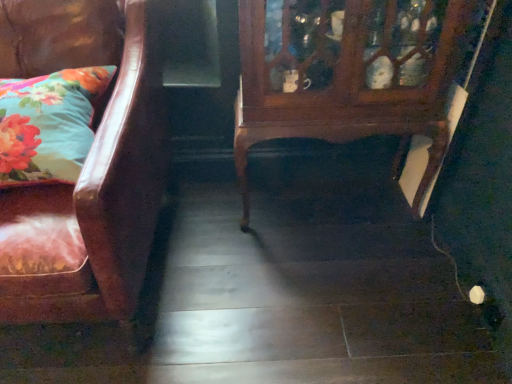
Describe the element at coordinates (93, 157) in the screenshot. This screenshot has height=384, width=512. I see `leather couch at left` at that location.

What do you see at coordinates (48, 124) in the screenshot?
I see `floral fabric pillow at left` at bounding box center [48, 124].

This screenshot has height=384, width=512. Find the location of `leather couch at left`. leather couch at left is located at coordinates (93, 157).

Considering the positions of objects wooden cabinet at center and floral fabric pillow at left in the image provided, who is more to the left, wooden cabinet at center or floral fabric pillow at left?

From the viewer's perspective, floral fabric pillow at left appears more on the left side.

Is wooden cabinet at center thinner than floral fabric pillow at left?

Yes.

Is wooden cabinet at center surrounding floral fabric pillow at left?

No, floral fabric pillow at left is not surrounded by wooden cabinet at center.

Considering the positions of objects wooden cabinet at center and floral fabric pillow at left in the image provided, who is in front, wooden cabinet at center or floral fabric pillow at left?

floral fabric pillow at left.

From a real-world perspective, is floral fabric pillow at left beneath leather couch at left?

No, from a real-world perspective, floral fabric pillow at left is not below leather couch at left.

Is floral fabric pillow at left to the left of leather couch at left from the viewer's perspective?

In fact, floral fabric pillow at left is to the right of leather couch at left.

Does point (39, 156) lie behind point (60, 2)?

No, (39, 156) is closer to viewer.

Can you confirm if floral fabric pillow at left is shorter than leather couch at left?

Indeed, floral fabric pillow at left has a lesser height compared to leather couch at left.

From the image's perspective, is floral fabric pillow at left located above or below wooden cabinet at center?

From the image's perspective, floral fabric pillow at left appears below wooden cabinet at center.

Are floral fabric pillow at left and wooden cabinet at center far apart?

That's not correct — floral fabric pillow at left is a little close to wooden cabinet at center.

Is floral fabric pillow at left aimed at wooden cabinet at center?

No, floral fabric pillow at left is not aimed at wooden cabinet at center.

Which is behind, point (81, 138) or point (295, 51)?

The point (295, 51) is more distant.

Is leather couch at left far from wooden cabinet at center?

Actually, leather couch at left and wooden cabinet at center are a little close together.

Is leather couch at left positioned with its back to wooden cabinet at center?

leather couch at left does not have its back to wooden cabinet at center.

Locate an element on the screen. The image size is (512, 384). furniture on the right of leather couch at left is located at coordinates (347, 74).

Is leather couch at left to the left of wooden cabinet at center from the viewer's perspective?

Yes.

Is leather couch at left wider than floral fabric pillow at left?

Yes, leather couch at left is wider than floral fabric pillow at left.

From a real-world perspective, is leather couch at left under floral fabric pillow at left?

Yes.

Is leather couch at left aimed at floral fabric pillow at left?

Yes, leather couch at left is oriented towards floral fabric pillow at left.

Would you consider leather couch at left to be distant from floral fabric pillow at left?

That's not correct — leather couch at left is a little close to floral fabric pillow at left.

Considering the sizes of objects wooden cabinet at center and leather couch at left in the image provided, who is wider, wooden cabinet at center or leather couch at left?

Wider between the two is leather couch at left.

From a real-world perspective, is wooden cabinet at center under leather couch at left?

Yes, from a real-world perspective, wooden cabinet at center is beneath leather couch at left.

Does wooden cabinet at center touch leather couch at left?

No, wooden cabinet at center is not with leather couch at left.

Does wooden cabinet at center turn towards leather couch at left?

No.

Where is `furniture located on the right of floral fabric pillow at left`? The image size is (512, 384). furniture located on the right of floral fabric pillow at left is located at coordinates (347, 74).

Find the location of `chair that is on the left side of floral fabric pillow at left`. chair that is on the left side of floral fabric pillow at left is located at coordinates (93, 157).

Based on the photo, when comparing their distances from leather couch at left, does floral fabric pillow at left or wooden cabinet at center seem closer?

floral fabric pillow at left lies closer to leather couch at left than the other object.

When comparing their distances from wooden cabinet at center, does leather couch at left or floral fabric pillow at left seem closer?

Based on the image, leather couch at left appears to be nearer to wooden cabinet at center.

From the image, which object appears to be farther from wooden cabinet at center, floral fabric pillow at left or leather couch at left?

floral fabric pillow at left is positioned further to the anchor wooden cabinet at center.

Considering their positions, is wooden cabinet at center positioned further to floral fabric pillow at left than leather couch at left?

The object further to floral fabric pillow at left is wooden cabinet at center.

Estimate the real-world distances between objects in this image. Which object is closer to floral fabric pillow at left, leather couch at left or wooden cabinet at center?

leather couch at left is closer to floral fabric pillow at left.

Estimate the real-world distances between objects in this image. Which object is further from leather couch at left, wooden cabinet at center or floral fabric pillow at left?

Among the two, wooden cabinet at center is located further to leather couch at left.

The image size is (512, 384). Find the location of `pillow between leather couch at left and wooden cabinet at center`. pillow between leather couch at left and wooden cabinet at center is located at coordinates (48, 124).